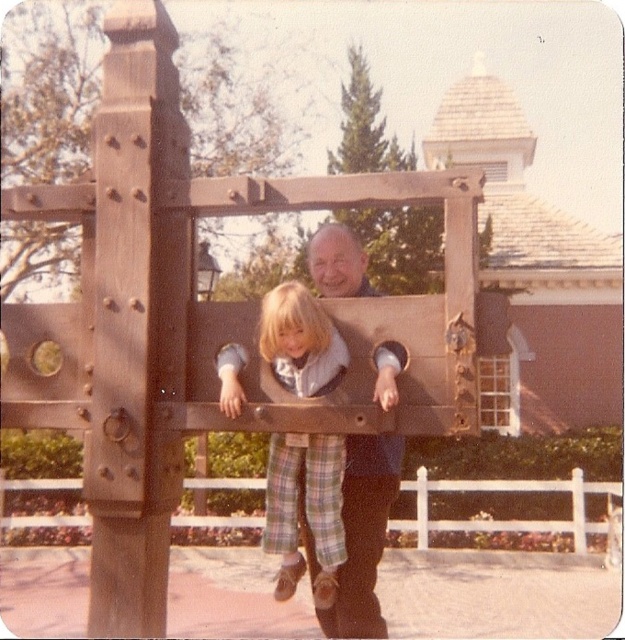
Question: Can you confirm if plaid pants at center is wider than matte brown wooden post at center?

Choices:
 (A) yes
 (B) no

Answer: (B)

Question: Does plaid pants at center appear on the right side of matte brown wooden post at center?

Choices:
 (A) no
 (B) yes

Answer: (A)

Question: Which object is closer to the camera taking this photo?

Choices:
 (A) plaid pants at center
 (B) matte brown wooden post at center

Answer: (A)

Question: Is plaid pants at center above matte brown wooden post at center?

Choices:
 (A) yes
 (B) no

Answer: (A)

Question: Among these points, which one is nearest to the camera?

Choices:
 (A) (371, 486)
 (B) (286, 522)

Answer: (B)